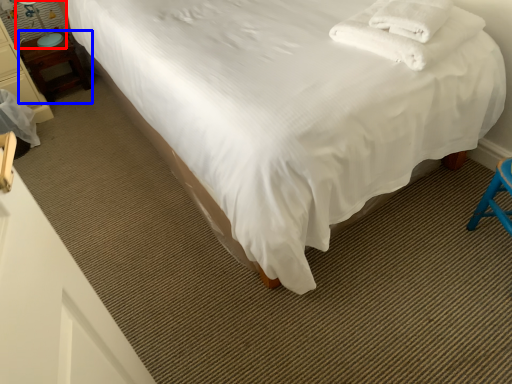
Question: Which point is closer to the camera, table lamp (highlighted by a red box) or nightstand (highlighted by a blue box)?

Choices:
 (A) table lamp
 (B) nightstand

Answer: (A)